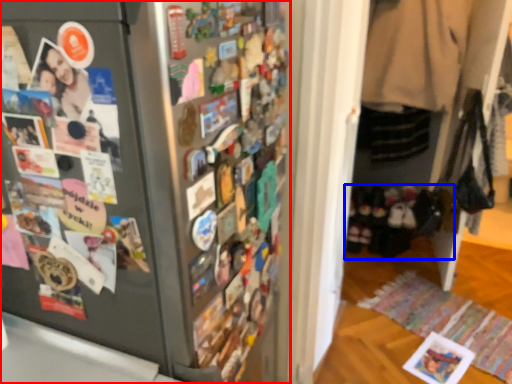
Question: Which point is further to the camera, refrigerator (highlighted by a red box) or footwear (highlighted by a blue box)?

Choices:
 (A) refrigerator
 (B) footwear

Answer: (B)